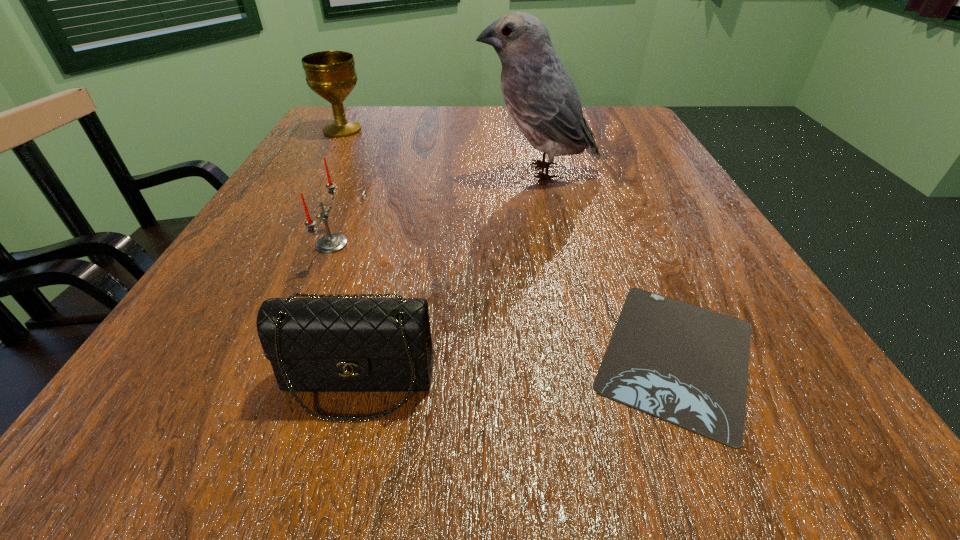
Find the location of a particular element. Image resolution: width=960 pixels, height=540 pixels. parrot is located at coordinates pyautogui.click(x=540, y=95).

At what (x,y) coordinates should I click in order to perform the action: click on the second farthest object. Please return your answer as a coordinate pair (x, y). The width and height of the screenshot is (960, 540). Looking at the image, I should click on (540, 95).

Where is `the farthest object`? This screenshot has width=960, height=540. the farthest object is located at coordinates (331, 74).

Identify the location of chalice. (331, 74).

Locate an element on the screen. the third farthest object is located at coordinates (330, 243).

At what (x,y) coordinates should I click in order to perform the action: click on clutch bag. Please return your answer as a coordinate pair (x, y). Looking at the image, I should click on (322, 343).

The width and height of the screenshot is (960, 540). In order to click on mousepad in this screenshot , I will do `click(687, 365)`.

Identify the location of vacant space located 0.250m on the front-facing side of the tallest object. The width and height of the screenshot is (960, 540). (x=354, y=172).

You are a GUI agent. You are given a task and a screenshot of the screen. Output one action in this format:
    pyautogui.click(x=<x>, y=<y>)
    Task: Click on the vacant space located on the front-facing side of the tallest object
    This screenshot has height=540, width=960.
    Given the screenshot: What is the action you would take?
    pyautogui.click(x=432, y=172)

Locate an element on the screen. free space located on the front-facing side of the tallest object is located at coordinates (369, 172).